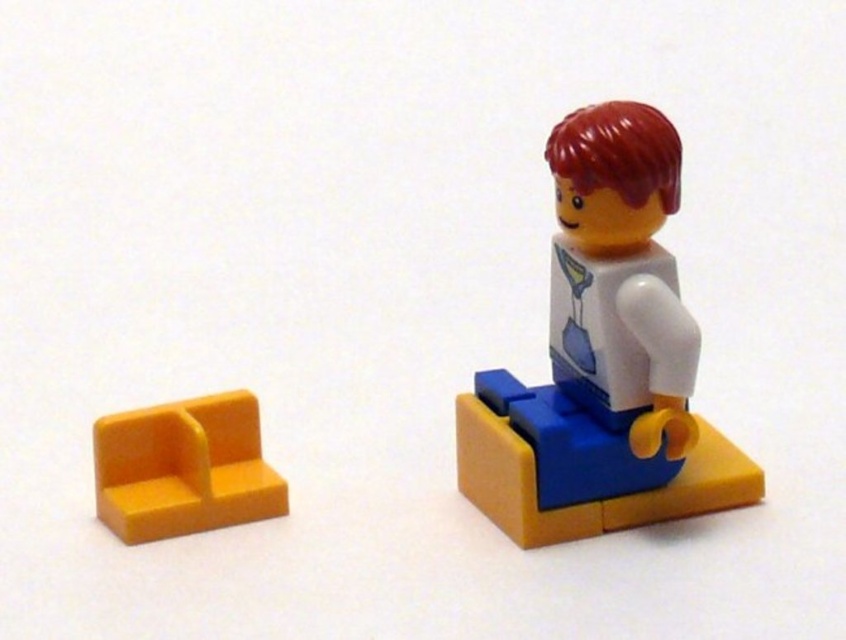
Question: Is white plastic minifigure at center above yellow plastic seat at lower left?

Choices:
 (A) yes
 (B) no

Answer: (A)

Question: Which point is closer to the camera taking this photo?

Choices:
 (A) (176, 465)
 (B) (700, 509)

Answer: (B)

Question: Is white plastic minifigure at center in front of yellow plastic seat at lower left?

Choices:
 (A) no
 (B) yes

Answer: (B)

Question: Among these objects, which one is farthest from the camera?

Choices:
 (A) yellow plastic seat at lower left
 (B) white plastic minifigure at center

Answer: (A)

Question: Is white plastic minifigure at center bigger than yellow plastic seat at lower left?

Choices:
 (A) yes
 (B) no

Answer: (A)